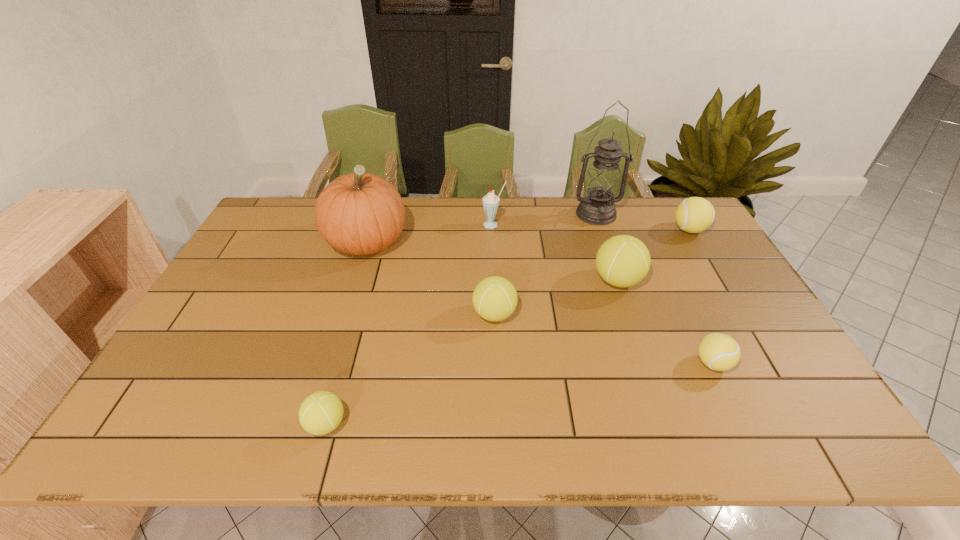
Where is `the second farthest green tennis ball`? The image size is (960, 540). the second farthest green tennis ball is located at coordinates (494, 298).

This screenshot has width=960, height=540. What are the coordinates of `the smaller yellow tennis ball` in the screenshot? It's located at (718, 351).

At what (x,y) coordinates should I click in order to perform the action: click on the fourth tennis ball from left to right. Please return your answer as a coordinate pair (x, y). Looking at the image, I should click on (718, 351).

Identify the location of the leftmost green tennis ball. This screenshot has height=540, width=960. (320, 413).

Identify the location of the smallest green tennis ball. (320, 413).

Where is `vacant space located 0.210m on the front of the gray oil lamp`? This screenshot has width=960, height=540. vacant space located 0.210m on the front of the gray oil lamp is located at coordinates (613, 265).

The height and width of the screenshot is (540, 960). Find the location of `vacant point located on the stem of the orange pumpkin`. vacant point located on the stem of the orange pumpkin is located at coordinates (348, 302).

The height and width of the screenshot is (540, 960). What are the coordinates of `vacant space located 0.270m on the straw side of the milkshake` in the screenshot? It's located at (495, 284).

At what (x,y) coordinates should I click in order to perform the action: click on vacant space located 0.200m on the back of the fourth nearest tennis ball. Please return your answer as a coordinate pair (x, y). The width and height of the screenshot is (960, 540). Looking at the image, I should click on (599, 227).

At what (x,y) coordinates should I click in order to perform the action: click on free space located on the front of the rightmost object. Please return your answer as a coordinate pair (x, y). This screenshot has height=540, width=960. Looking at the image, I should click on point(745,324).